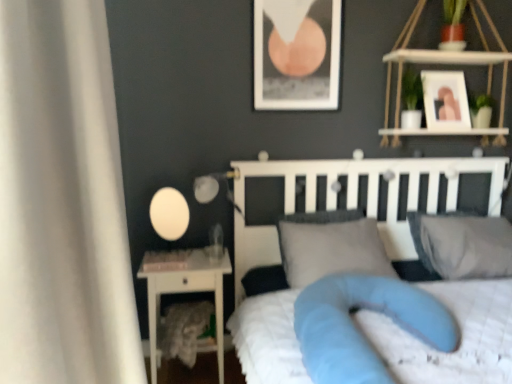
Question: In terms of height, does white glossy nightstand at left look taller or shorter compared to gray fabric pillow at center, the 2th pillow positioned from the right?

Choices:
 (A) tall
 (B) short

Answer: (A)

Question: From a real-world perspective, relative to gray fabric pillow at center, the 2th pillow positioned from the right, is white glossy nightstand at left vertically above or below?

Choices:
 (A) above
 (B) below

Answer: (B)

Question: Estimate the real-world distances between objects in this image. Which object is farther from the matte black picture frame at upper center, marked as the second picture frame in a right-to-left arrangement?

Choices:
 (A) white glossy nightstand at left
 (B) white soft bed at center
 (C) gray fabric pillow at center, the 1th pillow when ordered from left to right
 (D) matte white glass at left, the 2th table lamp in the left-to-right sequence
 (E) white wood shelf at upper right

Answer: (A)

Question: Which is nearer to the white fabric curtain at left?

Choices:
 (A) gray fabric pillow at upper right, marked as the 1th pillow in a right-to-left arrangement
 (B) white glossy picture frame at upper right, the second picture frame viewed from the left
 (C) blue fabric mattress at center
 (D) white glossy nightstand at left
 (E) matte black picture frame at upper center, marked as the second picture frame in a right-to-left arrangement

Answer: (C)